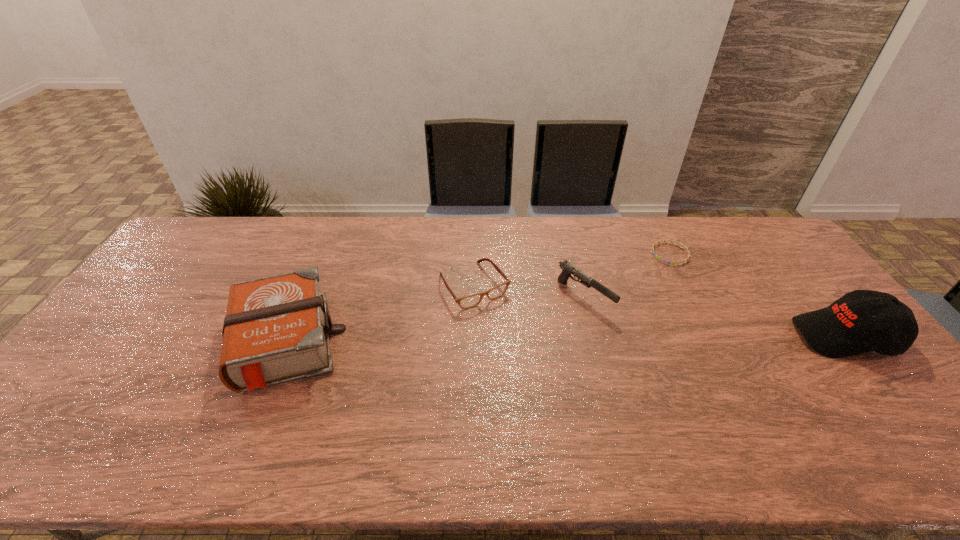
Where is `vacant region that satisfies the following two spatial constraints: 1. on the back side of the baseball cap; 2. on the front-facing side of the leftmost object`? vacant region that satisfies the following two spatial constraints: 1. on the back side of the baseball cap; 2. on the front-facing side of the leftmost object is located at coordinates (287, 336).

Image resolution: width=960 pixels, height=540 pixels. Identify the location of free location that satisfies the following two spatial constraints: 1. on the back side of the leftmost object; 2. on the front-facing side of the baseball cap. (287, 336).